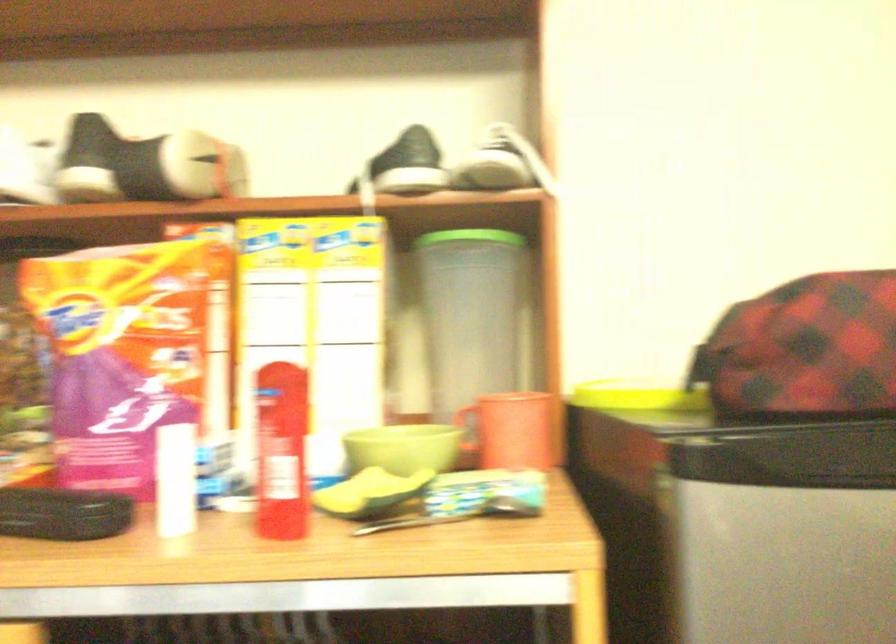
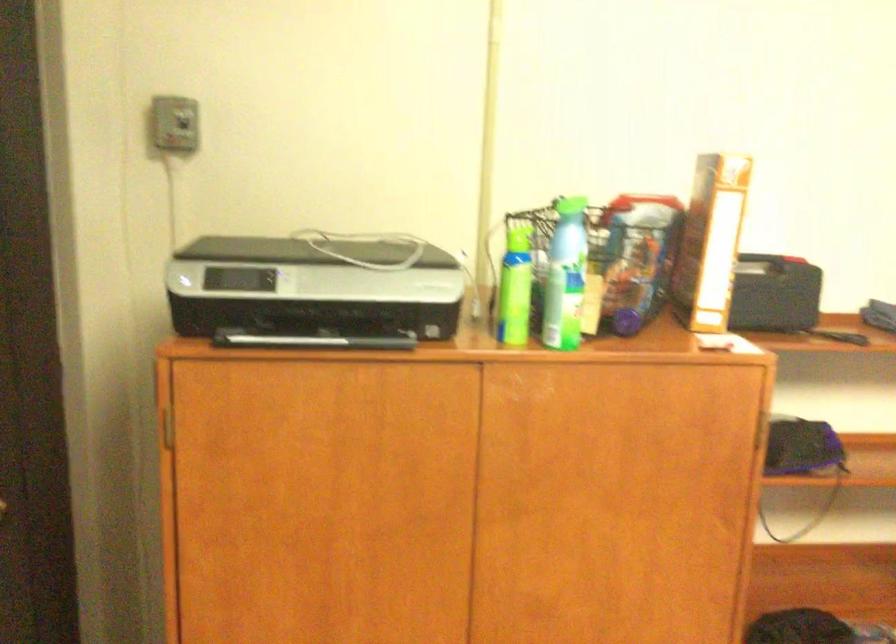
Question: How did the camera likely rotate?

Choices:
 (A) Left
 (B) Right
 (C) Up
 (D) Down

Answer: (B)